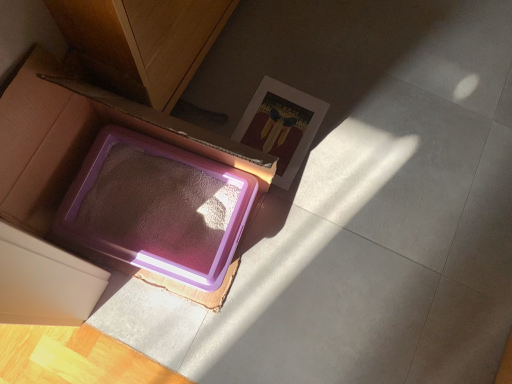
Identify the location of purple plastic tray at lower left. (63, 142).

What is the approximate width of purple plastic tray at lower left?

It is 14.61 inches.

What do you see at coordinates (63, 142) in the screenshot? This screenshot has width=512, height=384. I see `purple plastic tray at lower left` at bounding box center [63, 142].

What is the approximate height of purple plastic tray at lower left?

purple plastic tray at lower left is 15.11 inches in height.

Image resolution: width=512 pixels, height=384 pixels. Identify the location of purple plastic tray at lower left. (63, 142).